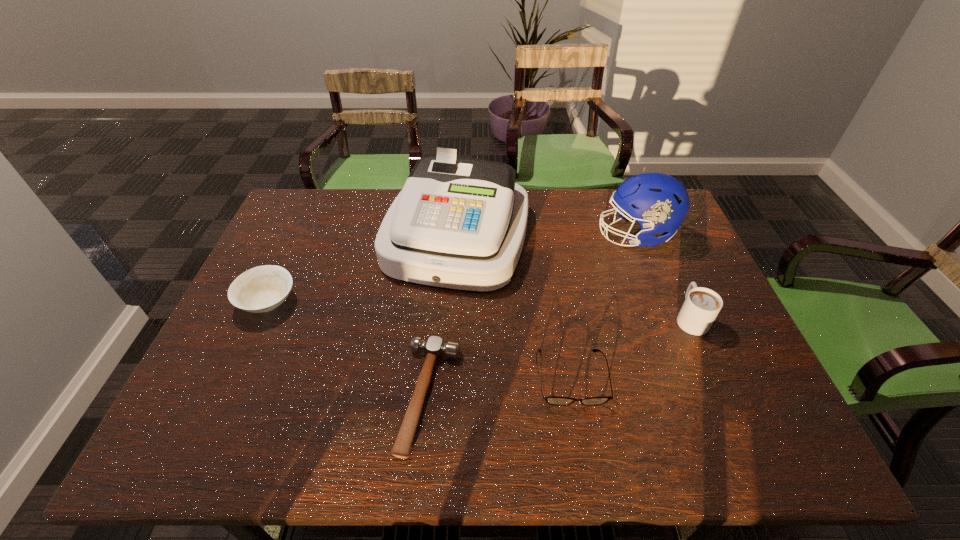
In order to click on cash register in this screenshot , I will do `click(459, 223)`.

Identify the location of football helmet. (659, 203).

Locate an element on the screen. Image resolution: width=960 pixels, height=540 pixels. cappuccino is located at coordinates (701, 306).

Locate an element on the screen. bowl is located at coordinates (261, 289).

This screenshot has width=960, height=540. Find the location of `the fourth tallest object`. the fourth tallest object is located at coordinates (261, 289).

Identify the location of spectacles. (551, 400).

Image resolution: width=960 pixels, height=540 pixels. In order to click on hammer in this screenshot , I will do `click(434, 347)`.

Identify the location of vacant region located on the left of the cash register. (331, 236).

Find the location of a particular element. This screenshot has width=960, height=540. vacant space located 0.320m on the face guard of the football helmet is located at coordinates (495, 235).

Locate an element on the screen. free space located on the face guard of the football helmet is located at coordinates (549, 235).